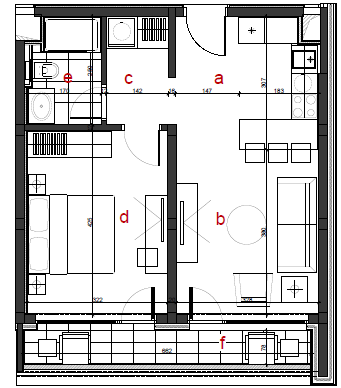
The width and height of the screenshot is (341, 388). I want to click on sink, so click(38, 107).